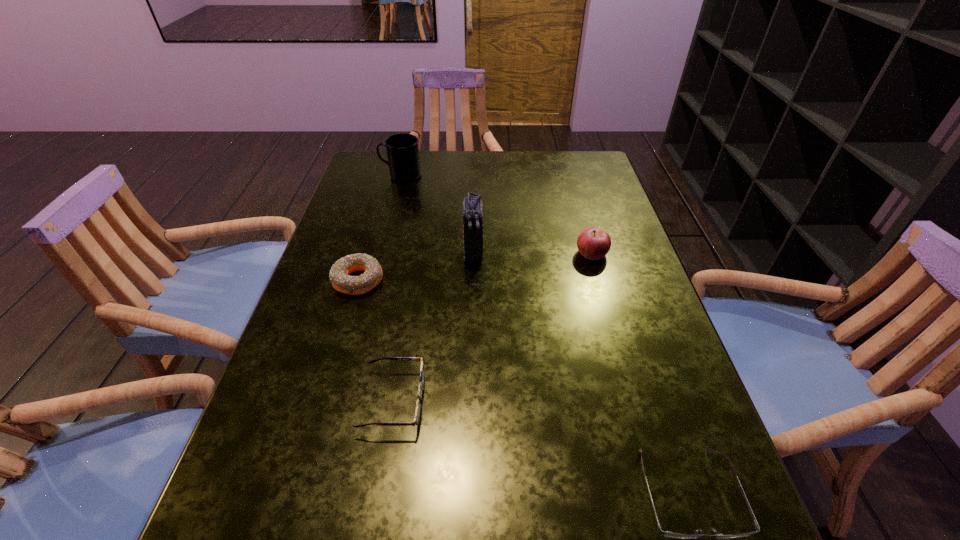
This screenshot has width=960, height=540. What are the coordinates of `free location at the far left corner of the desktop` in the screenshot? It's located at click(365, 160).

Locate an element on the screen. vacant space at the far right corner of the desktop is located at coordinates (594, 188).

Image resolution: width=960 pixels, height=540 pixels. Find the location of `free spot between the left spectacles and the doughnut`. free spot between the left spectacles and the doughnut is located at coordinates (375, 341).

Locate an element on the screen. vacant point located between the taller spectacles and the doughnut is located at coordinates (375, 341).

Locate an element on the screen. This screenshot has width=960, height=540. vacant point located between the doughnut and the farthest object is located at coordinates (379, 228).

Where is `vacant area that lies between the mug and the second nearest object`? vacant area that lies between the mug and the second nearest object is located at coordinates (397, 288).

This screenshot has width=960, height=540. In order to click on empty space that is in between the fifth farthest object and the fourth shortest object in this screenshot , I will do `click(492, 327)`.

Image resolution: width=960 pixels, height=540 pixels. Find the location of `blank region between the mug and the tallest object`. blank region between the mug and the tallest object is located at coordinates (438, 214).

Identify the location of free point between the apple and the mug. (496, 214).

You are a GUI agent. You are given a task and a screenshot of the screen. Output one action in this format:
    pyautogui.click(x=<x>, y=<y>)
    Task: Click on the fourth closest object relative to the fourth shortest object
    
    Given the screenshot: What is the action you would take?
    pyautogui.click(x=664, y=533)